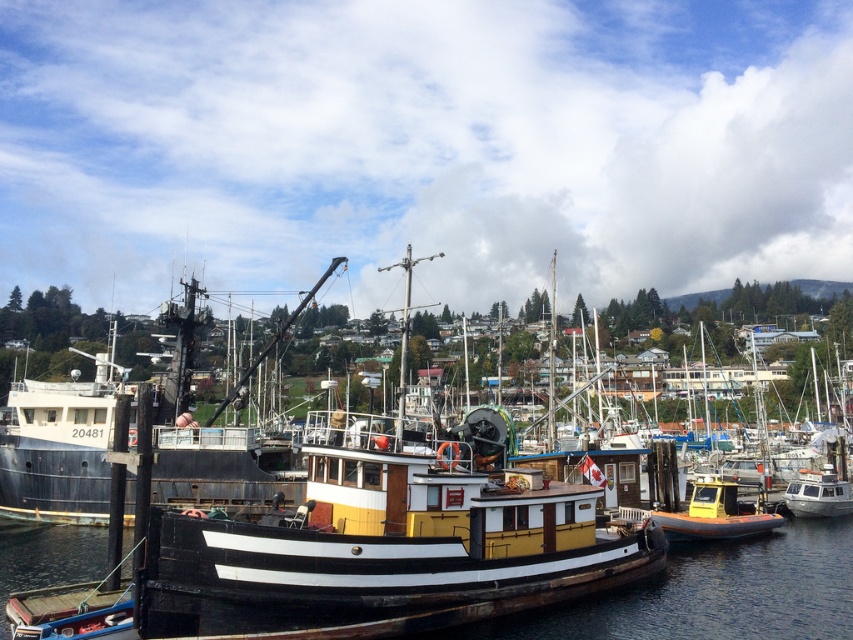
Is point (173, 467) positioned before point (744, 552)?

No, (173, 467) is behind (744, 552).

Is yellow matte boat at center below black wood boat at center?

Actually, yellow matte boat at center is above black wood boat at center.

The image size is (853, 640). Describe the element at coordinates (210, 465) in the screenshot. I see `yellow matte boat at center` at that location.

You are a GUI agent. You are given a task and a screenshot of the screen. Output one action in this format:
    pyautogui.click(x=<x>, y=<y>)
    Task: Click on the yellow matte boat at center
    The image size is (853, 640).
    Given the screenshot: What is the action you would take?
    pyautogui.click(x=210, y=465)